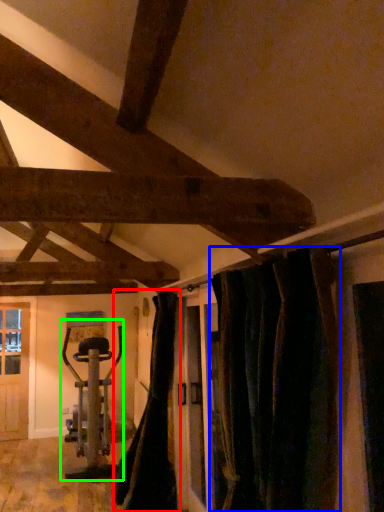
Question: Which is nearer to the curtain (highlighted by a red box)? curtain (highlighted by a blue box) or sport equipment (highlighted by a green box).

Choices:
 (A) curtain
 (B) sport equipment

Answer: (B)